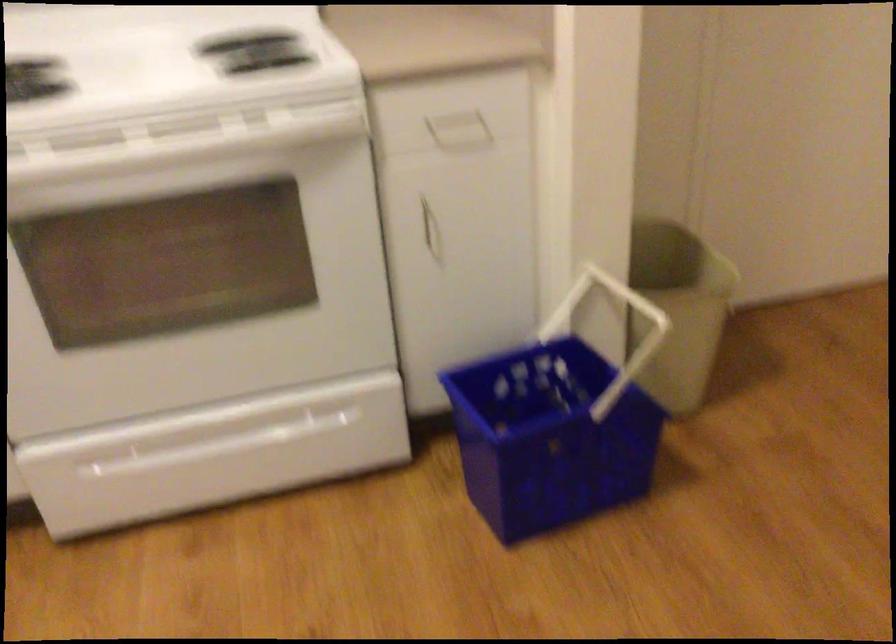
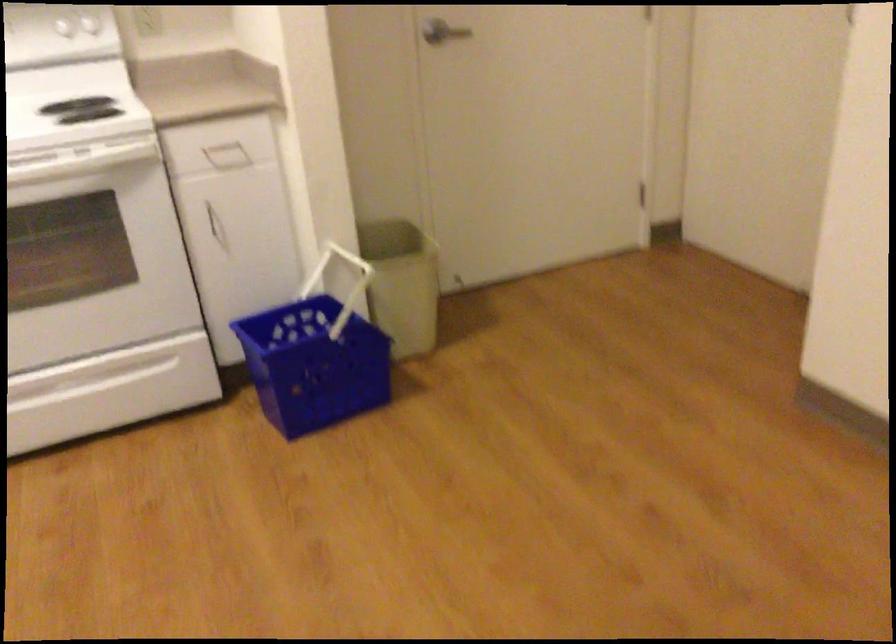
The point at (459, 129) is marked in the first image. Where is the corresponding point in the second image?

(227, 156)